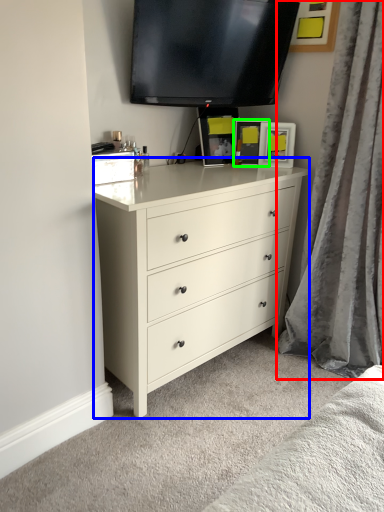
Question: Based on their relative distances, which object is nearer to curtain (highlighted by a red box)? Choose from chest of drawers (highlighted by a blue box) and picture frame (highlighted by a green box).

Choices:
 (A) chest of drawers
 (B) picture frame

Answer: (A)